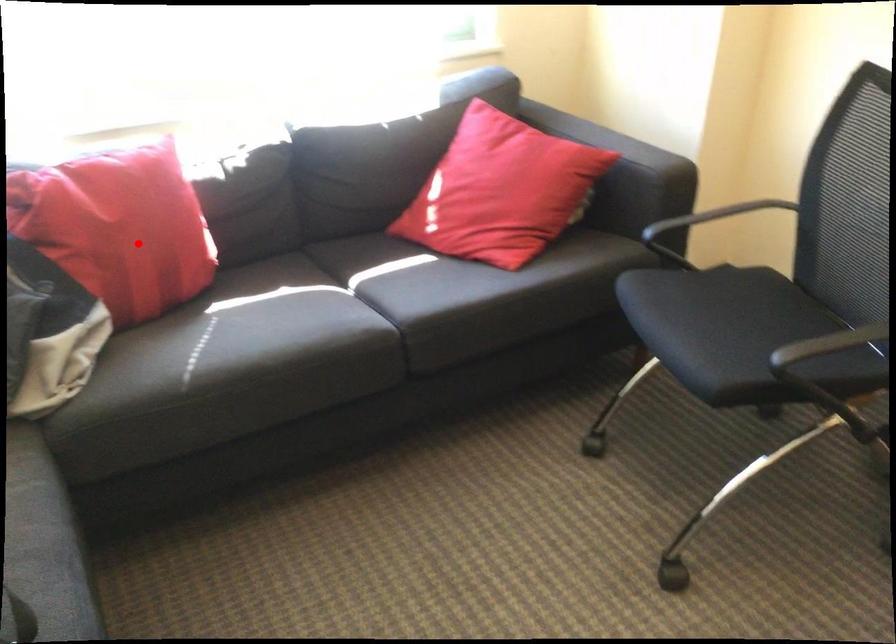
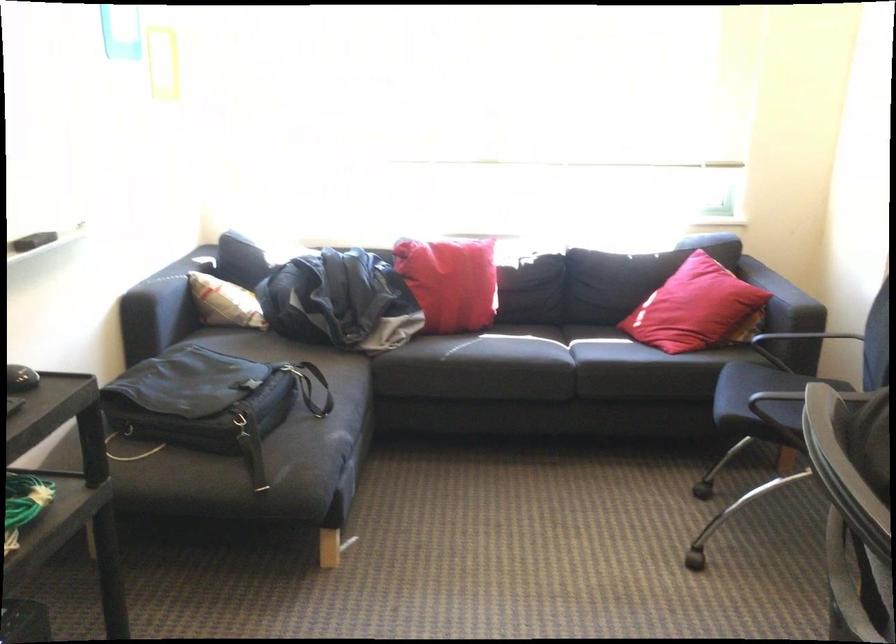
Locate, in the second image, the point that corresponds to the highlighted location in the first image.

(450, 281)